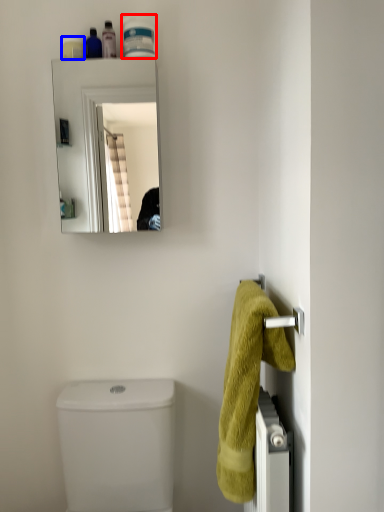
Question: Which object appears farthest to the camera in this image, toiletry (highlighted by a red box) or toiletry (highlighted by a blue box)?

Choices:
 (A) toiletry
 (B) toiletry

Answer: (B)